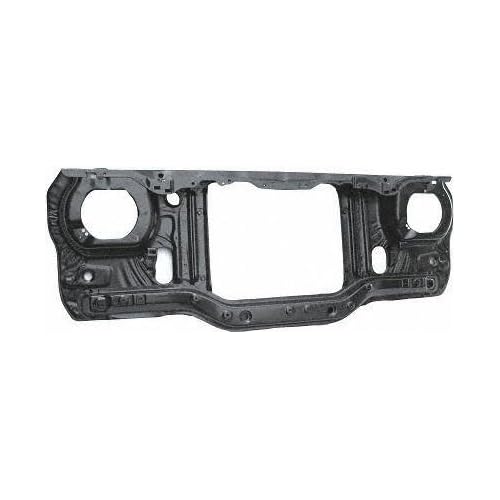
Locate an element on the screen. This screenshot has width=500, height=500. bottom crossbar is located at coordinates (285, 313).